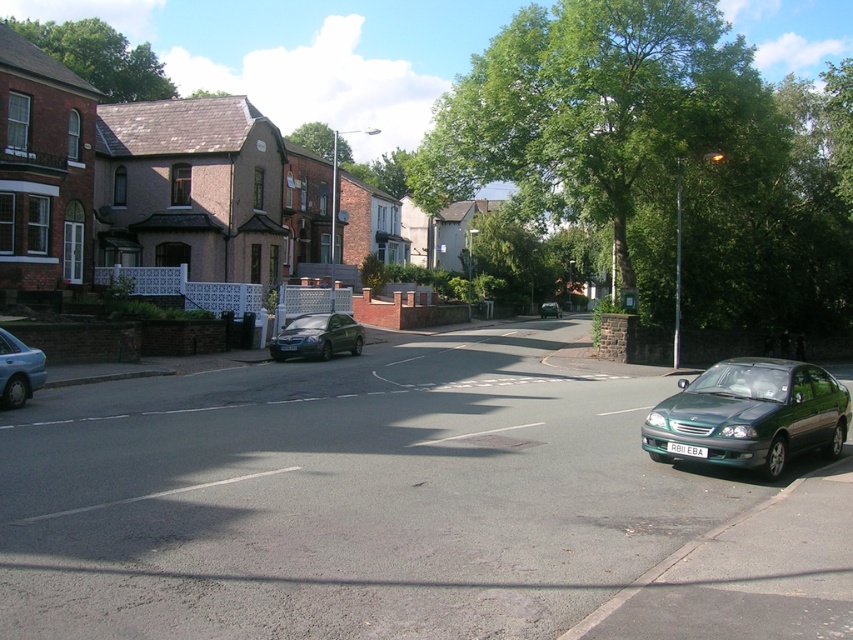
Question: Is shiny silver sedan at center below metallic silver sedan at center?

Choices:
 (A) yes
 (B) no

Answer: (A)

Question: Is green leafy tree at upper center smaller than metallic silver sedan at left?

Choices:
 (A) yes
 (B) no

Answer: (B)

Question: Among these points, which one is farthest from the camera?

Choices:
 (A) (312, 324)
 (B) (759, 433)
 (C) (555, 314)

Answer: (C)

Question: Which point appears closest to the camera in this image?

Choices:
 (A) (833, 385)
 (B) (306, 317)
 (C) (50, 32)

Answer: (A)

Question: Does green leafy tree at upper left have a smaller size compared to metallic silver sedan at left?

Choices:
 (A) no
 (B) yes

Answer: (A)

Question: Which point is farther from the camera taking this photo?

Choices:
 (A) (x=695, y=253)
 (B) (x=550, y=308)
 (C) (x=697, y=410)
 (D) (x=135, y=81)

Answer: (B)